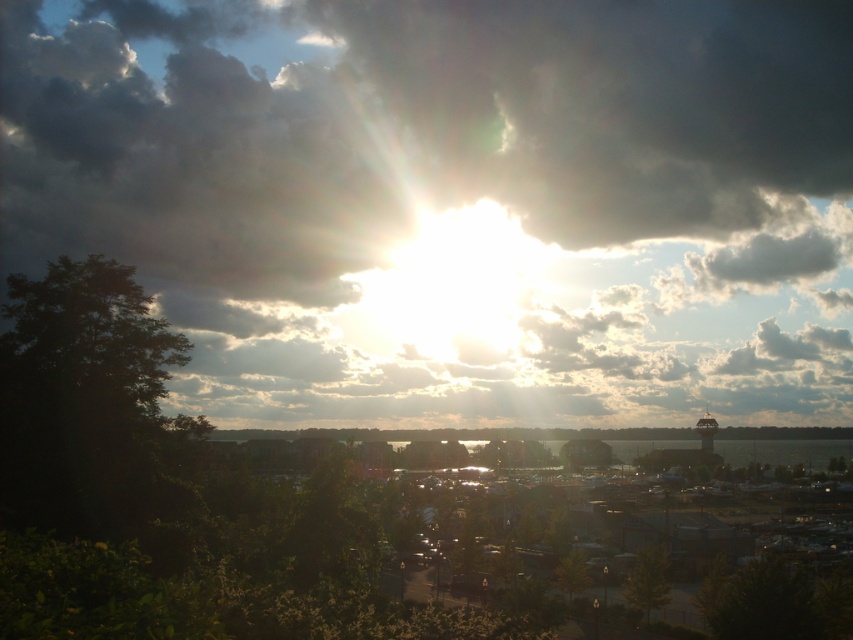
Between point (157, 388) and point (581, 556), which one is positioned behind?

Positioned behind is point (581, 556).

Can you confirm if dark green leafy tree at left is taller than green matte tree at lower center?

Yes, dark green leafy tree at left is taller than green matte tree at lower center.

Does point (74, 467) come in front of point (578, 566)?

Yes, it is.

The image size is (853, 640). Identify the location of dark green leafy tree at left. (86, 403).

Is dark green leafy tree at left behind green matte tree at lower right?

No, dark green leafy tree at left is closer to the viewer.

Is point (74, 260) more distant than point (647, 557)?

No.

This screenshot has height=640, width=853. I want to click on dark green leafy tree at left, so click(x=86, y=403).

Between point (254, 216) and point (796, 579), which one is positioned behind?

The point (254, 216) is behind.

How distant is cloudy at upper center from green leafy tree at lower right?

cloudy at upper center is 109.77 meters away from green leafy tree at lower right.

Which is in front, point (244, 81) or point (752, 611)?

Positioned in front is point (752, 611).

You are a GUI agent. You are given a task and a screenshot of the screen. Output one action in this format:
    pyautogui.click(x=<x>, y=<y>)
    Task: Click on the cloudy at upper center
    This screenshot has width=853, height=640.
    Given the screenshot: What is the action you would take?
    pyautogui.click(x=453, y=202)